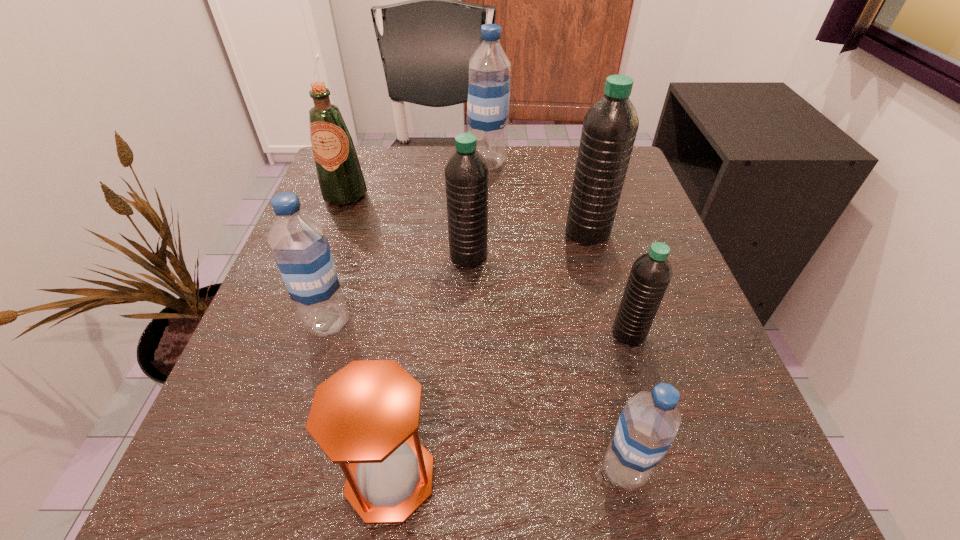
Find the location of a particular element. the farthest object is located at coordinates (488, 102).

Identify the location of the farthest water bottle. (488, 102).

Image resolution: width=960 pixels, height=540 pixels. Identify the location of the biggest black water bottle. (609, 129).

Locate an element on the screen. This screenshot has width=960, height=540. green olive oil is located at coordinates (340, 177).

Locate an element on the screen. The image size is (960, 540). the second farthest object is located at coordinates (340, 177).

I want to click on the second biggest black water bottle, so click(x=466, y=172).

Image resolution: width=960 pixels, height=540 pixels. I want to click on the leftmost blue water bottle, so click(298, 242).

Identify the location of the second farthest blue water bottle. (298, 242).

Where is `the nearest black water bottle`? The height and width of the screenshot is (540, 960). the nearest black water bottle is located at coordinates (650, 275).

The height and width of the screenshot is (540, 960). In order to click on the nearest water bottle in this screenshot , I will do `click(648, 424)`.